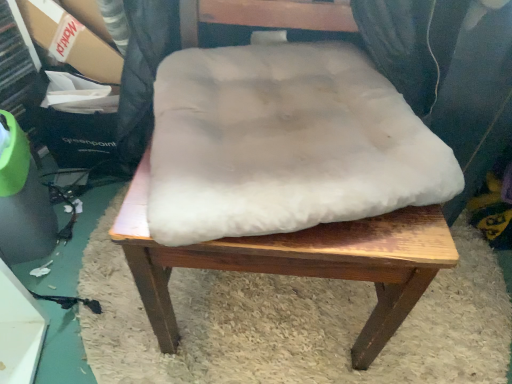
Locate an element on the screen. This screenshot has height=384, width=512. empty space that is ontop of white fluffy cushion at center (from a real-world perspective) is located at coordinates (250, 170).